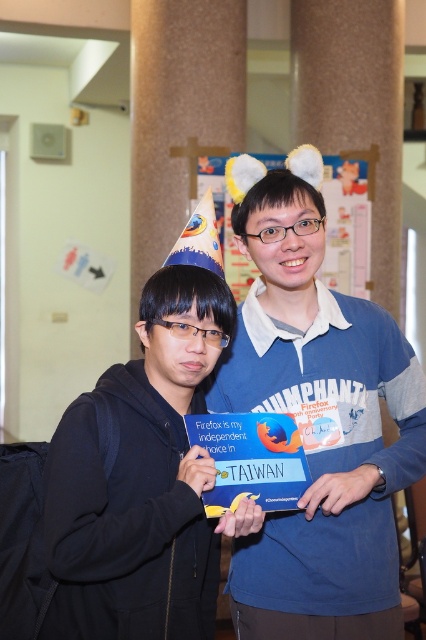
Is blue fabric shirt at center to the right of black matte jacket at center from the viewer's perspective?

Indeed, blue fabric shirt at center is positioned on the right side of black matte jacket at center.

Is blue fabric shirt at center taller than black matte jacket at center?

Yes, blue fabric shirt at center is taller than black matte jacket at center.

Between point (290, 404) and point (143, 307), which one is positioned behind?

The point (290, 404) is more distant.

Identify the location of blue fabric shirt at center. This screenshot has height=640, width=426. (316, 420).